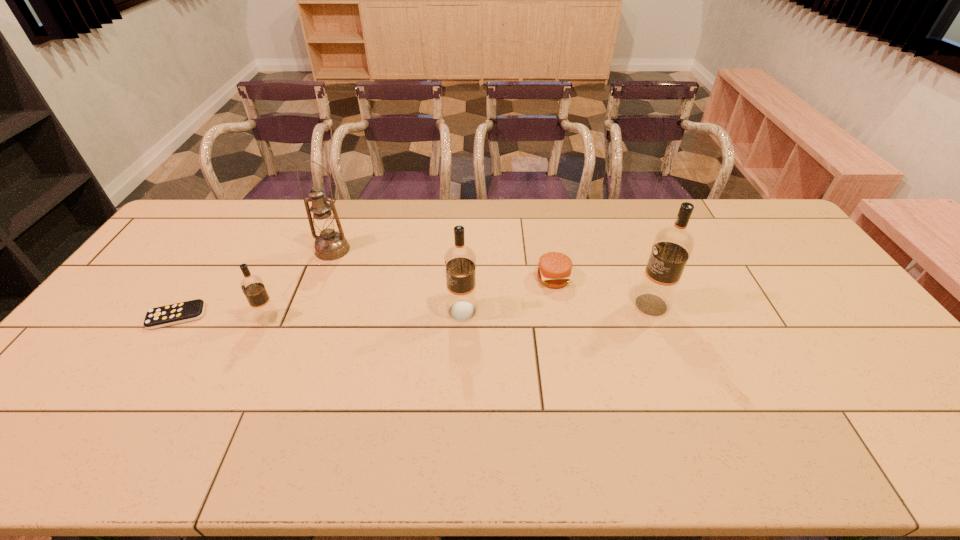
Locate an element on the screen. Image resolution: width=960 pixels, height=540 pixels. vodka that can be found as the closest to the rightmost object is located at coordinates (460, 261).

Choose which vodka is the third nearest neighbor to the second object from right to left. Please provide its 2D coordinates. Your answer should be formatted as a tuple, i.e. [(x, y)], where the tuple contains the x and y coordinates of a point satisfying the conditions above.

[(253, 288)]

You are a GUI agent. You are given a task and a screenshot of the screen. Output one action in this format:
    pyautogui.click(x=<x>, y=<y>)
    Task: Click on the vacant space that satisfies the following two spatial constraints: 1. on the back side of the second object from right to left; 2. on the right side of the shortest object
    
    Given the screenshot: What is the action you would take?
    pyautogui.click(x=203, y=278)

This screenshot has width=960, height=540. Find the location of `free space that satisfies the following two spatial constraints: 1. on the front side of the farthest object; 2. on the right side of the fifth object from left to right`. free space that satisfies the following two spatial constraints: 1. on the front side of the farthest object; 2. on the right side of the fifth object from left to right is located at coordinates (322, 278).